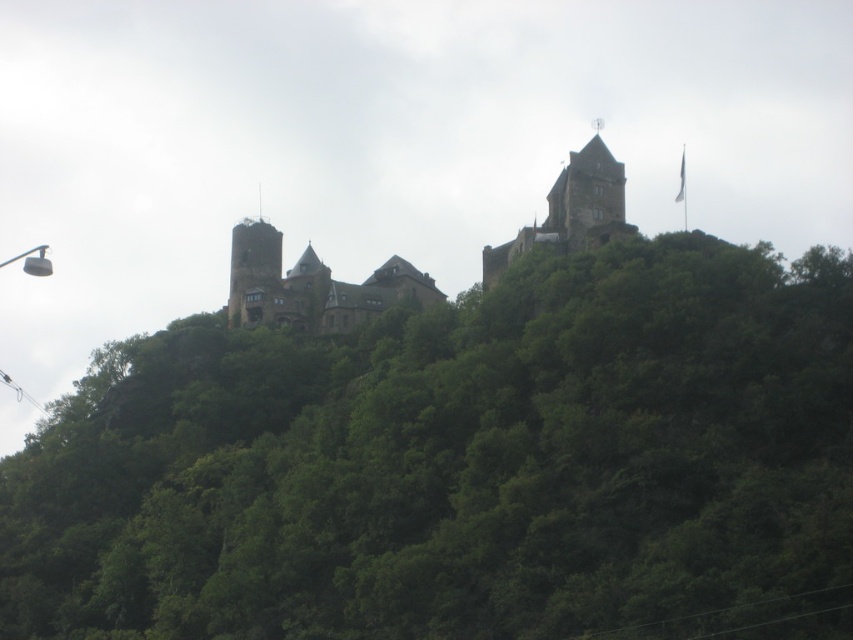
Does green leafy tree at upper center have a greater height compared to brown stone castle at center?

Yes.

Image resolution: width=853 pixels, height=640 pixels. What do you see at coordinates (462, 465) in the screenshot?
I see `green leafy tree at upper center` at bounding box center [462, 465].

You are a GUI agent. You are given a task and a screenshot of the screen. Output one action in this format:
    pyautogui.click(x=<x>, y=<y>)
    Task: Click on the green leafy tree at upper center
    This screenshot has width=853, height=640.
    Given the screenshot: What is the action you would take?
    [x=462, y=465]